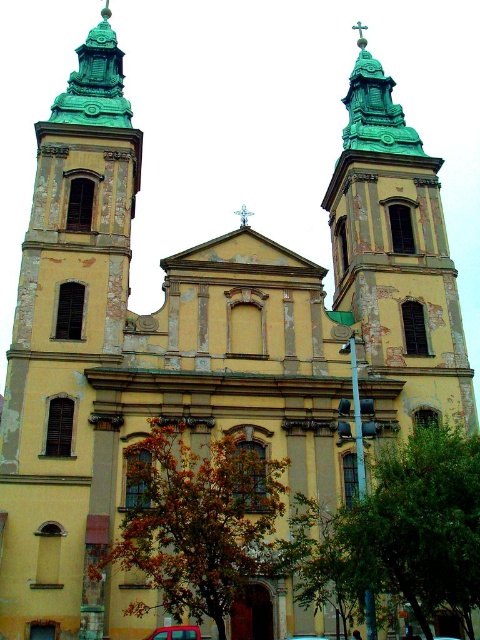
Question: Which of the following is the farthest from the observer?

Choices:
 (A) metallic red car at lower center
 (B) metallic blue car at center

Answer: (B)

Question: Does metallic red car at lower center appear on the right side of metallic blue car at center?

Choices:
 (A) yes
 (B) no

Answer: (B)

Question: Does metallic red car at lower center lie in front of metallic blue car at center?

Choices:
 (A) yes
 (B) no

Answer: (A)

Question: Which point is closer to the camera?

Choices:
 (A) (165, 637)
 (B) (311, 637)

Answer: (A)

Question: Can you confirm if metallic red car at lower center is positioned to the left of metallic blue car at center?

Choices:
 (A) no
 (B) yes

Answer: (B)